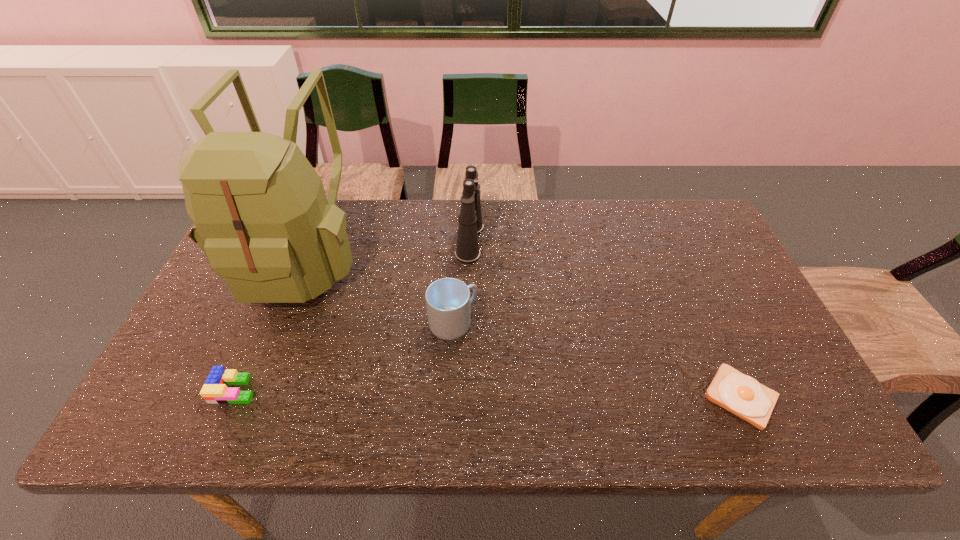
You are a GUI agent. You are given a task and a screenshot of the screen. Output one action in this format:
    pyautogui.click(x=<x>, y=<y>)
    Task: Click on the free space between the tallest object and the binoculars
    
    Given the screenshot: What is the action you would take?
    pyautogui.click(x=386, y=250)

Locate an element on the screen. free space between the backpack and the binoculars is located at coordinates (386, 250).

Identify the location of vacant space that's between the third tallest object and the Lego. (344, 356).

The image size is (960, 540). In order to click on vacant area between the mug and the toast in this screenshot , I will do `click(597, 360)`.

Find the location of a particular element. This screenshot has height=540, width=960. vacant space that is in between the Lego and the binoculars is located at coordinates (352, 315).

The height and width of the screenshot is (540, 960). In order to click on the second closest object to the backpack in this screenshot , I will do `click(448, 301)`.

Where is `object that stands as the closest to the backpack`? This screenshot has height=540, width=960. object that stands as the closest to the backpack is located at coordinates (214, 390).

In order to click on free space that satisfies the following two spatial constraints: 1. on the front pocket of the tallest object; 2. on the right side of the toast in this screenshot , I will do `click(245, 397)`.

Where is `free space that satisfies the following two spatial constraints: 1. on the back side of the third shortest object; 2. on the right side of the fourth shortest object`? The image size is (960, 540). free space that satisfies the following two spatial constraints: 1. on the back side of the third shortest object; 2. on the right side of the fourth shortest object is located at coordinates (458, 241).

Image resolution: width=960 pixels, height=540 pixels. I want to click on blank area in the image that satisfies the following two spatial constraints: 1. on the back side of the binoculars; 2. on the right side of the fourth tallest object, so click(x=299, y=241).